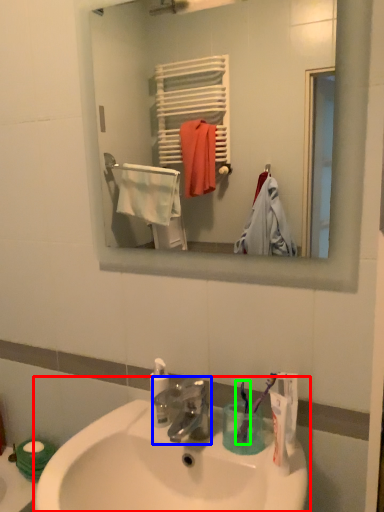
Question: Which object is positioned closest to sink (highlighted by a red box)? Select from tap (highlighted by a blue box) and toothbrush (highlighted by a green box).

Choices:
 (A) tap
 (B) toothbrush

Answer: (A)